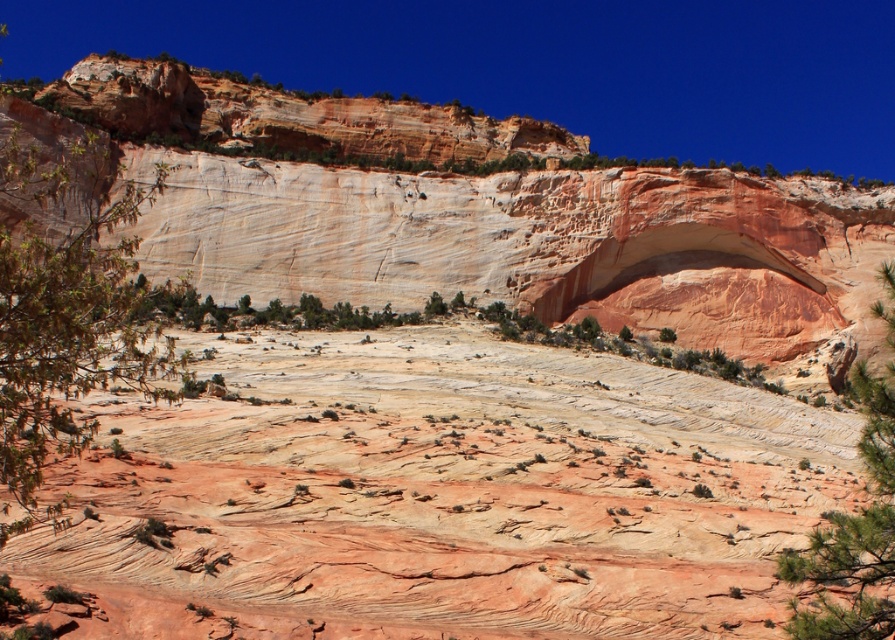
You are a hiker standing at the base of the rustic sandstone terrain at center and want to reach the green leafy tree at lower right. Which direction should you move to get closer to the tree?

The rustic sandstone terrain at center has a lesser height compared to the green leafy tree at lower right, so you should move downward from the terrain towards the lower right direction to reach the tree.

You are standing at the base of the large layered rock formation in the image. You notice a point marked at coordinates [441,493]. Based on the scene description, what type of terrain does this point most likely represent?

The point at [441,493] corresponds to rustic sandstone terrain at center, as described in the scene details.

You are standing at the base of the large layered rock formation and see the green leafy tree at left and the green leafy tree at lower right. Which tree is closer to you?

The green leafy tree at left is closer to you because it is in front of the green leafy tree at lower right.